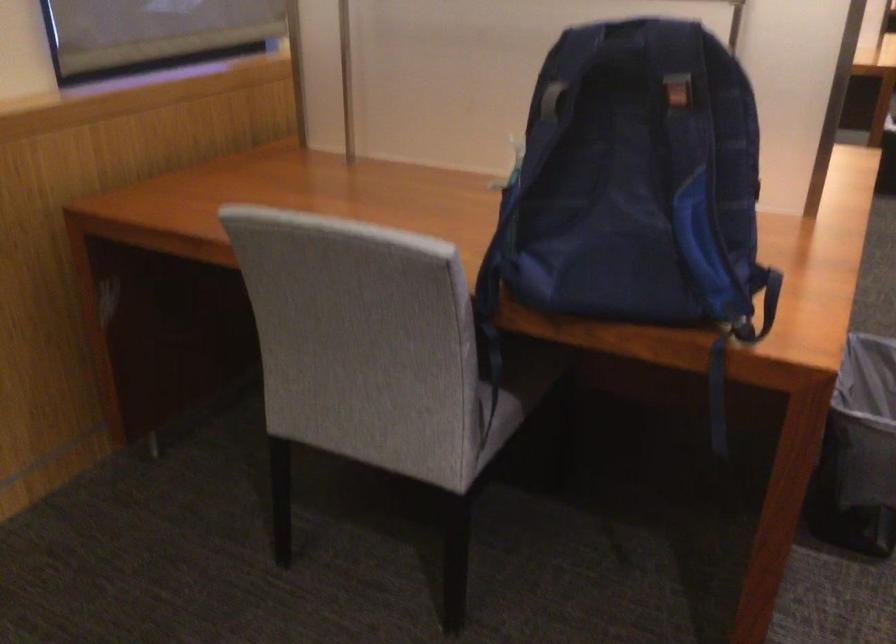
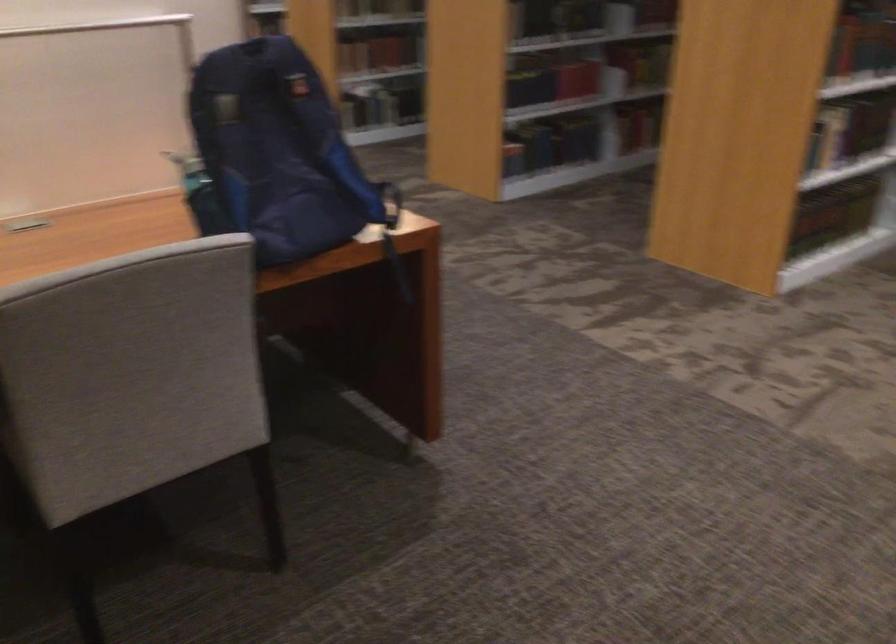
In the second image, find the point that corresponds to point 746,342 in the first image.

(392, 234)